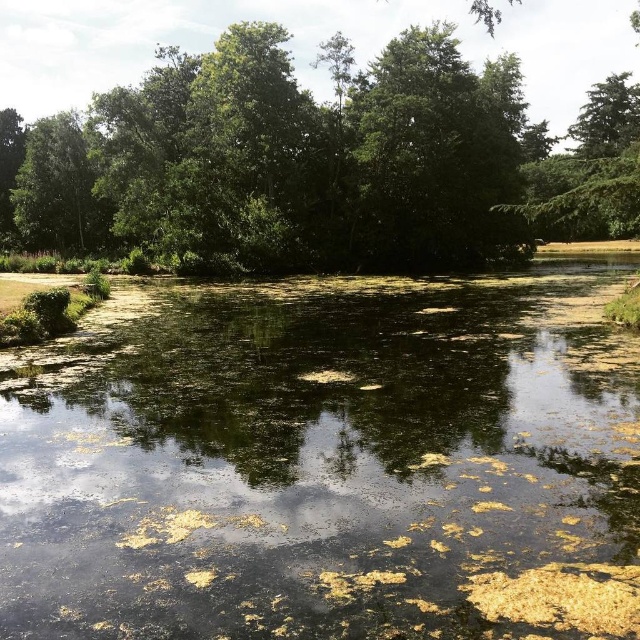
Consider the image. Can you confirm if green algae-covered water at center is bigger than green leafy tree at center?

Incorrect, green algae-covered water at center is not larger than green leafy tree at center.

Can you confirm if green algae-covered water at center is positioned below green leafy tree at center?

Indeed, green algae-covered water at center is positioned under green leafy tree at center.

Where is `green algae-covered water at center`? green algae-covered water at center is located at coordinates (326, 461).

This screenshot has height=640, width=640. Identify the location of green algae-covered water at center. (326, 461).

Does green algae-covered water at center have a larger size compared to green leafy tree at left?

Actually, green algae-covered water at center might be smaller than green leafy tree at left.

Consider the image. Between green algae-covered water at center and green leafy tree at left, which one has less height?

green algae-covered water at center

At what (x,y) coordinates should I click in order to perform the action: click on green algae-covered water at center. Please return your answer as a coordinate pair (x, y). Image resolution: width=640 pixels, height=640 pixels. Looking at the image, I should click on (326, 461).

Is green leafy tree at center smaller than green leafy tree at left?

Actually, green leafy tree at center might be larger than green leafy tree at left.

Who is lower down, green leafy tree at center or green leafy tree at left?

green leafy tree at left is below.

Where is `green leafy tree at center`? This screenshot has width=640, height=640. green leafy tree at center is located at coordinates (317, 161).